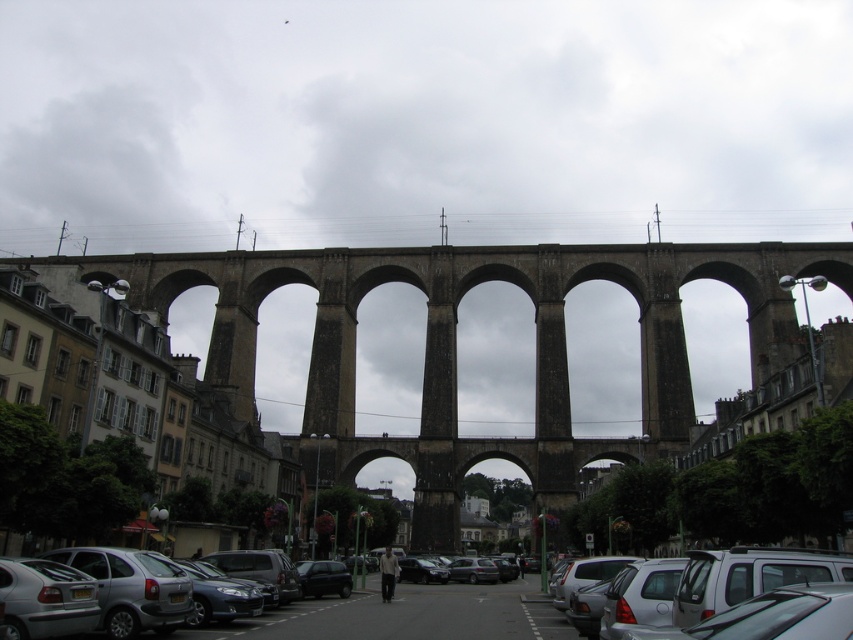
Does point (440, 307) come behind point (628, 563)?

Yes, it is behind point (628, 563).

I want to click on brown stone bridge at center, so click(456, 348).

Who is more distant from viewer, [728,586] or [332,566]?

Positioned behind is point [332,566].

Which is below, silver metallic car at lower right or shiny black car at center?

Positioned lower is shiny black car at center.

The width and height of the screenshot is (853, 640). What do you see at coordinates (717, 582) in the screenshot?
I see `silver metallic car at lower right` at bounding box center [717, 582].

Identify the location of silver metallic car at lower right. (717, 582).

Is brown stone bridge at center closer to camera compared to shiny black car at center?

No, brown stone bridge at center is further to the viewer.

Between brown stone bridge at center and shiny black car at center, which one appears on the left side from the viewer's perspective?

From the viewer's perspective, shiny black car at center appears more on the left side.

Between point (323, 477) and point (318, 596), which one is positioned behind?

Positioned behind is point (323, 477).

What are the coordinates of `brown stone bridge at center` in the screenshot? It's located at (456, 348).